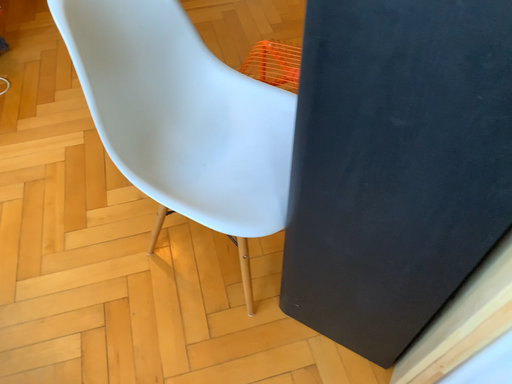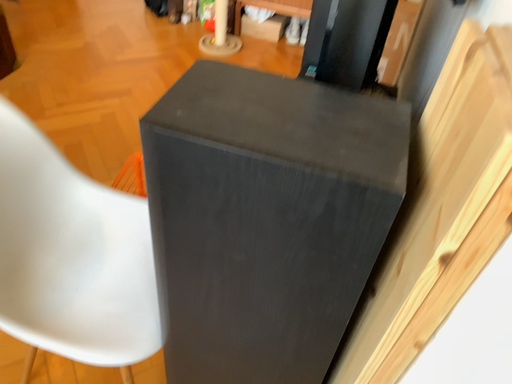
Question: How did the camera likely rotate when shooting the video?

Choices:
 (A) rotated downward
 (B) rotated upward

Answer: (B)